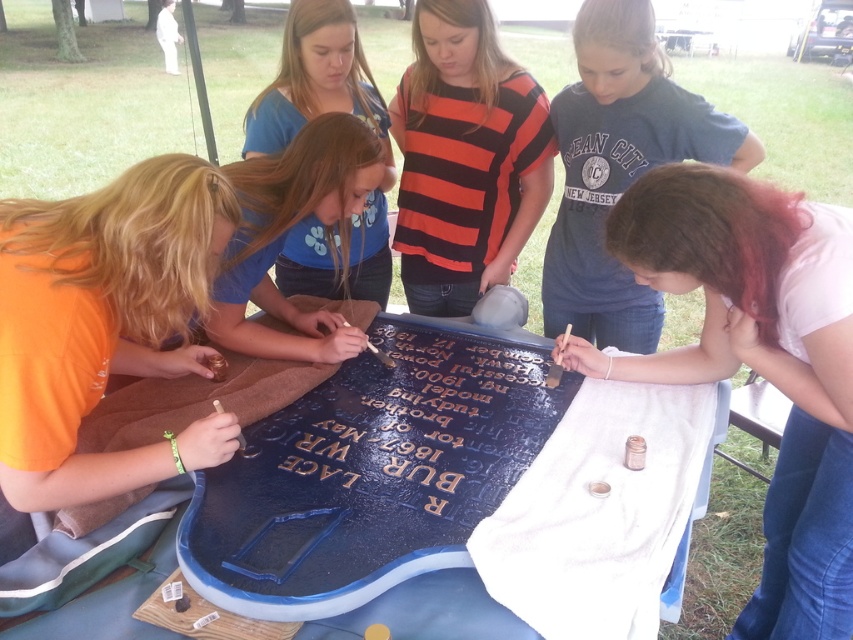
Which is behind, point (831, 326) or point (436, 337)?

The point (436, 337) is more distant.

Between matte black marker at lower right and gold embossed plaque at center, which one appears on the left side from the viewer's perspective?

Positioned to the left is gold embossed plaque at center.

The width and height of the screenshot is (853, 640). What do you see at coordinates (759, 362) in the screenshot?
I see `matte black marker at lower right` at bounding box center [759, 362].

Locate an element on the screen. The image size is (853, 640). matte black marker at lower right is located at coordinates (759, 362).

Measure the distance between point (x=316, y=506) and camera.

Point (x=316, y=506) is 1.14 meters from camera.

Is gold embossed plaque at center shorter than orange-red striped shirt at center?

Indeed, gold embossed plaque at center has a lesser height compared to orange-red striped shirt at center.

This screenshot has height=640, width=853. What are the coordinates of `gold embossed plaque at center` in the screenshot? It's located at (408, 436).

Locate an element on the screen. gold embossed plaque at center is located at coordinates (408, 436).

Is point (839, 596) less distant than point (305, 93)?

That is True.

Measure the distance between point (769, 230) and camera.

Point (769, 230) and camera are 3.73 feet apart from each other.

Identify the location of matte black marker at lower right. (759, 362).